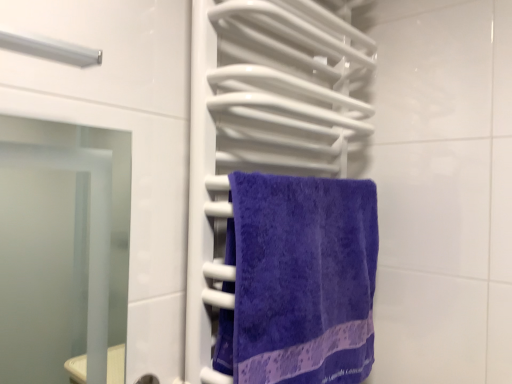
Question: From the image's perspective, is purple terry cloth towel at center positioned above or below purple soft towel at center?

Choices:
 (A) above
 (B) below

Answer: (B)

Question: From a real-world perspective, is purple terry cloth towel at center physically located above or below purple soft towel at center?

Choices:
 (A) below
 (B) above

Answer: (A)

Question: Considering the positions of point (327, 360) and point (316, 82), is point (327, 360) closer or farther from the camera than point (316, 82)?

Choices:
 (A) closer
 (B) farther

Answer: (A)

Question: Is purple soft towel at center wider or thinner than purple terry cloth towel at center?

Choices:
 (A) thin
 (B) wide

Answer: (B)

Question: From the image's perspective, is purple soft towel at center located above or below purple terry cloth towel at center?

Choices:
 (A) above
 (B) below

Answer: (A)

Question: Is purple soft towel at center spatially inside purple terry cloth towel at center, or outside of it?

Choices:
 (A) inside
 (B) outside

Answer: (B)

Question: Looking at the image, does purple soft towel at center seem bigger or smaller compared to purple terry cloth towel at center?

Choices:
 (A) small
 (B) big

Answer: (B)